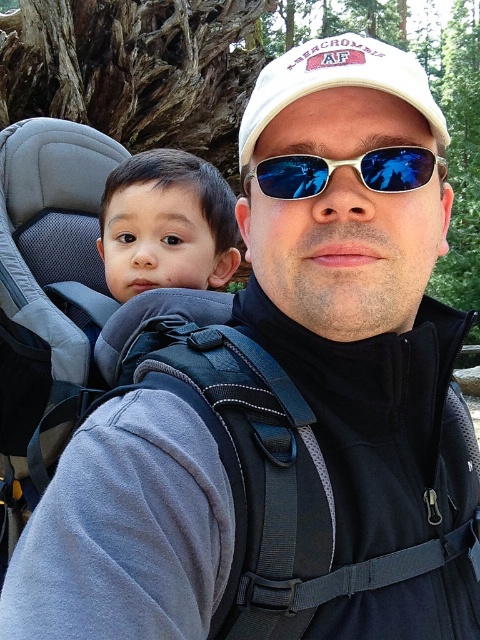
Is black fabric strap at center below smooth skin baby at center?

Yes.

Which of these two, black fabric strap at center or smooth skin baby at center, stands shorter?

With less height is smooth skin baby at center.

What do you see at coordinates (274, 483) in the screenshot? I see `black fabric strap at center` at bounding box center [274, 483].

At what (x,y) coordinates should I click in order to perform the action: click on black fabric strap at center. Please return your answer as a coordinate pair (x, y). This screenshot has width=480, height=640. Looking at the image, I should click on (274, 483).

Can you confirm if black fabric strap at center is positioned above blue reflective plastic sunglasses at center?

Incorrect, black fabric strap at center is not positioned above blue reflective plastic sunglasses at center.

Between point (433, 520) and point (312, 172), which one is positioned behind?

Positioned behind is point (312, 172).

Where is `black fabric strap at center`? black fabric strap at center is located at coordinates (274, 483).

Who is positioned more to the left, smooth skin baby at center or blue reflective plastic sunglasses at center?

smooth skin baby at center

Does smooth skin baby at center have a greater height compared to blue reflective plastic sunglasses at center?

Yes.

Between point (162, 227) and point (276, 173), which one is positioned behind?

Positioned behind is point (162, 227).

Locate an element on the screen. Image resolution: width=480 pixels, height=640 pixels. smooth skin baby at center is located at coordinates (167, 225).